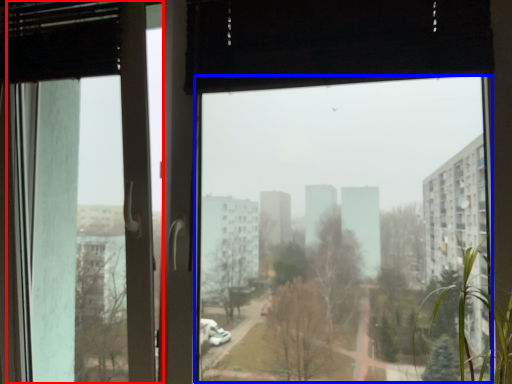
Question: Which object is further to the camera taking this photo, screen door (highlighted by a red box) or window screen (highlighted by a blue box)?

Choices:
 (A) screen door
 (B) window screen

Answer: (A)